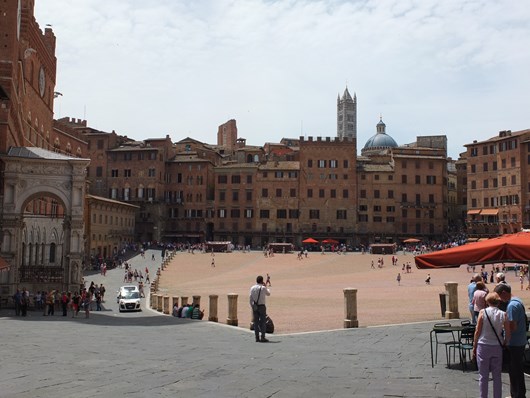
I want to click on table, so 446,329.